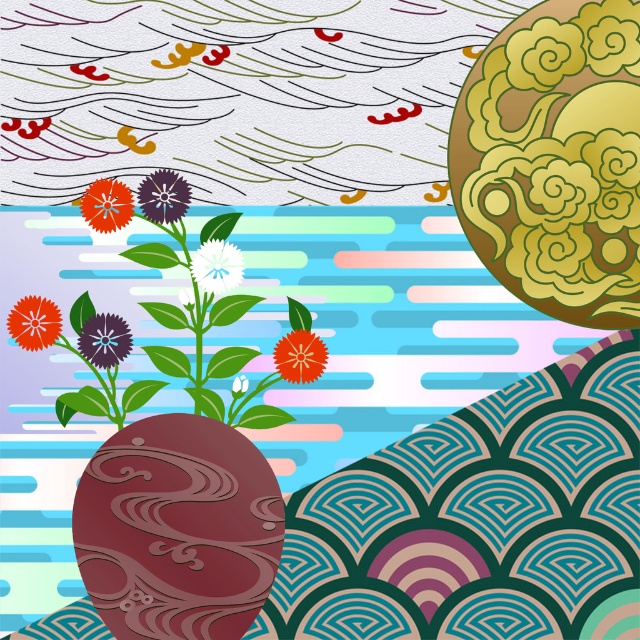
Question: Among these objects, which one is nearest to the camera?

Choices:
 (A) matte orange flower at upper left
 (B) purple matte flower at center
 (C) brown glossy stone at center

Answer: (C)

Question: Is matte orange flower at upper left wider than smooth red flower at center?

Choices:
 (A) no
 (B) yes

Answer: (A)

Question: Which point is closer to the camera taking this photo?

Choices:
 (A) (284, 336)
 (B) (173, 204)
 (C) (22, 324)

Answer: (C)

Question: Which point is farther to the camera?

Choices:
 (A) smooth red flower at center
 (B) matte orange flower at upper left
 (C) purple matte flower at center-left

Answer: (A)

Question: Is brown glossy stone at center above white matte flower at center?

Choices:
 (A) no
 (B) yes

Answer: (A)

Question: Does matte orange flower at lower left have a larger size compared to matte orange flower at upper left?

Choices:
 (A) yes
 (B) no

Answer: (B)